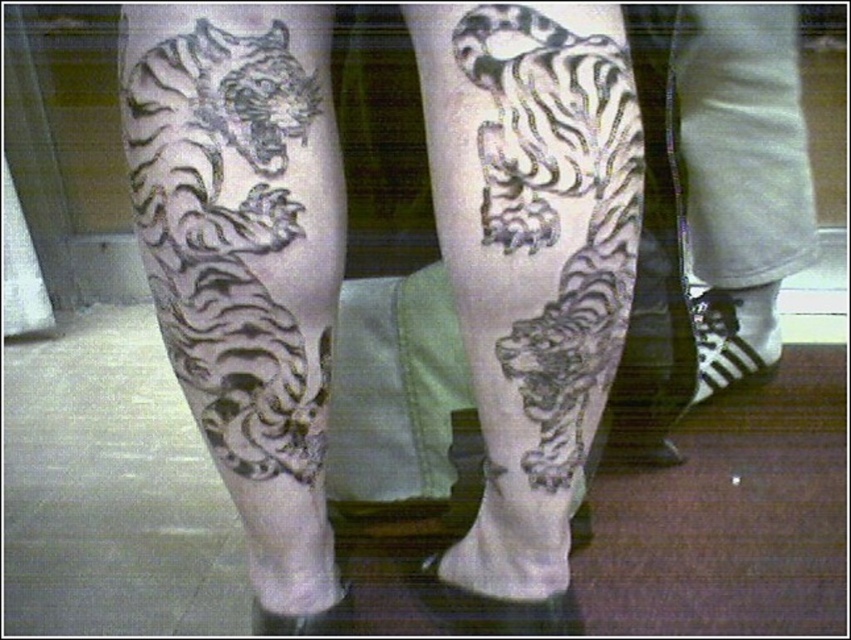
You are a tattoo artist examining the legs in the image. You need to determine which tattoo element is closer to the viewer. Based on the black ink tiger at upper left and the white cotton socks at lower right, which one is positioned in front?

The black ink tiger at upper left is in front of the white cotton socks at lower right, so it is closer to the viewer.

You are an artist analyzing the placement of tattoos on a person. You notice the black ink tiger at upper left and the black ink tiger at center. Which tiger is located to the left of the other?

The black ink tiger at upper left is positioned on the left side of black ink tiger at center.

You are an artist examining the intricate tattoos on the legs. You notice two points marked at coordinates point (566, 272) and point (707, 172). Which of these points is closer to you as you look at the tattoos?

Point (566, 272) is in front of point (707, 172), so it is closer to you.